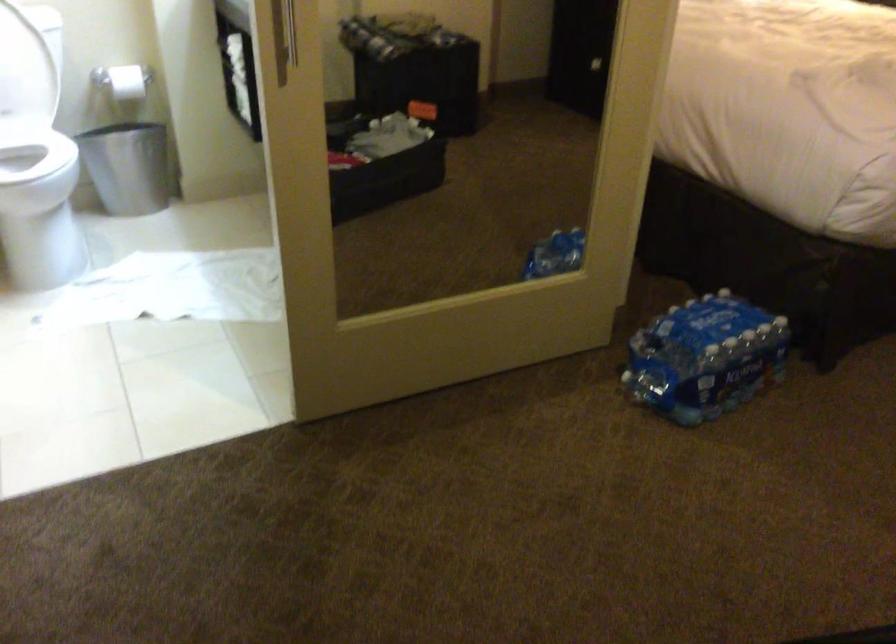
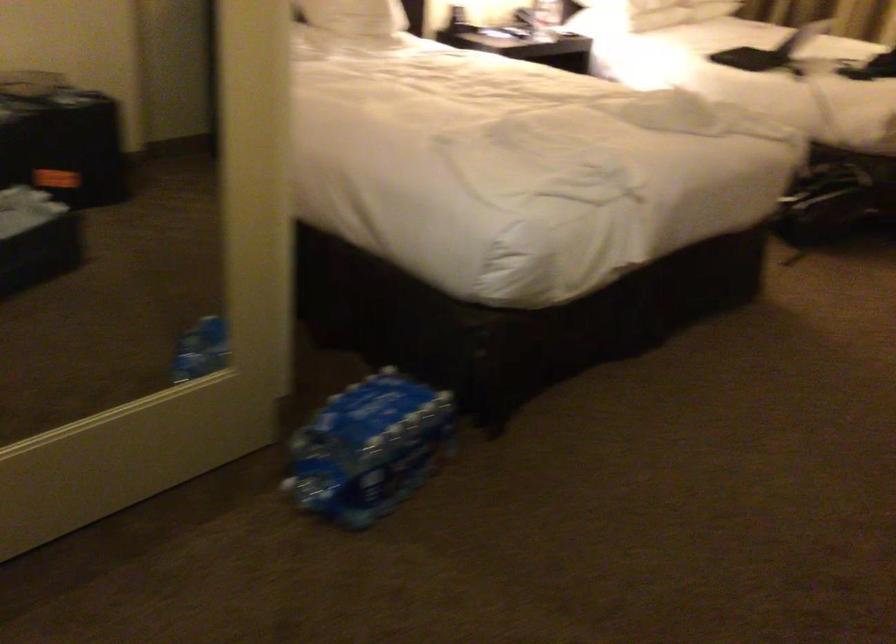
Where in the second image is the point corresponding to [699,353] from the first image?

(367, 448)